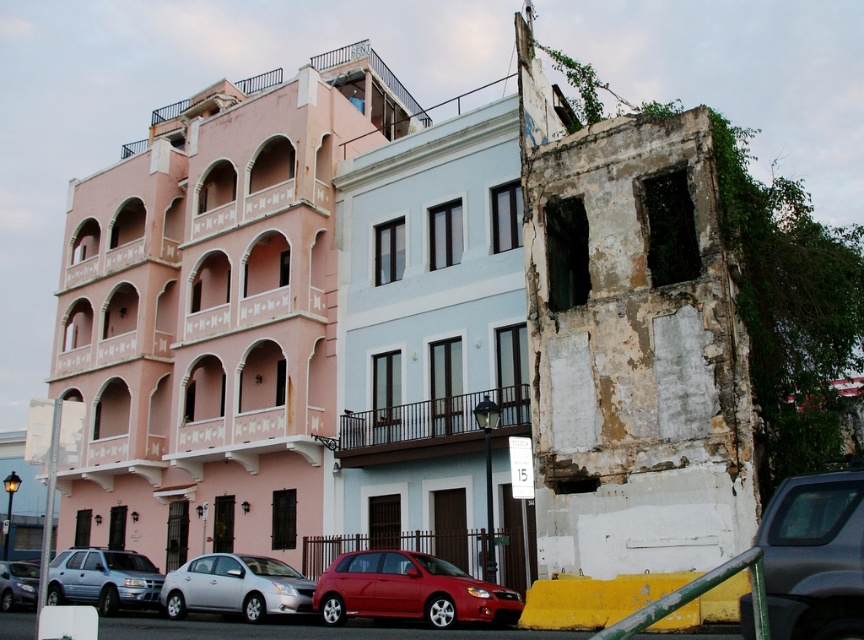
Who is shorter, shiny red hatchback at center or silver metallic sedan at lower left?

shiny red hatchback at center is shorter.

Who is lower down, shiny red hatchback at center or silver metallic sedan at lower left?

silver metallic sedan at lower left is below.

Which is behind, point (426, 586) or point (172, 577)?

Point (172, 577)

Locate an element on the screen. shiny red hatchback at center is located at coordinates (410, 589).

Looking at this image, is shiny red hatchback at center to the right of matte silver suv at lower left from the viewer's perspective?

Correct, you'll find shiny red hatchback at center to the right of matte silver suv at lower left.

Can you confirm if shiny red hatchback at center is wider than matte silver suv at lower left?

No, shiny red hatchback at center is not wider than matte silver suv at lower left.

The image size is (864, 640). Find the location of `shiny red hatchback at center`. shiny red hatchback at center is located at coordinates (410, 589).

Is metallic gray sedan at lower right to the right of metallic silver sedan at lower left from the viewer's perspective?

Indeed, metallic gray sedan at lower right is positioned on the right side of metallic silver sedan at lower left.

Who is positioned more to the right, metallic gray sedan at lower right or metallic silver sedan at lower left?

Positioned to the right is metallic gray sedan at lower right.

You are a GUI agent. You are given a task and a screenshot of the screen. Output one action in this format:
    pyautogui.click(x=<x>, y=<y>)
    Task: Click on the metallic gray sedan at lower right
    Image resolution: width=864 pixels, height=640 pixels.
    Given the screenshot: What is the action you would take?
    pyautogui.click(x=814, y=556)